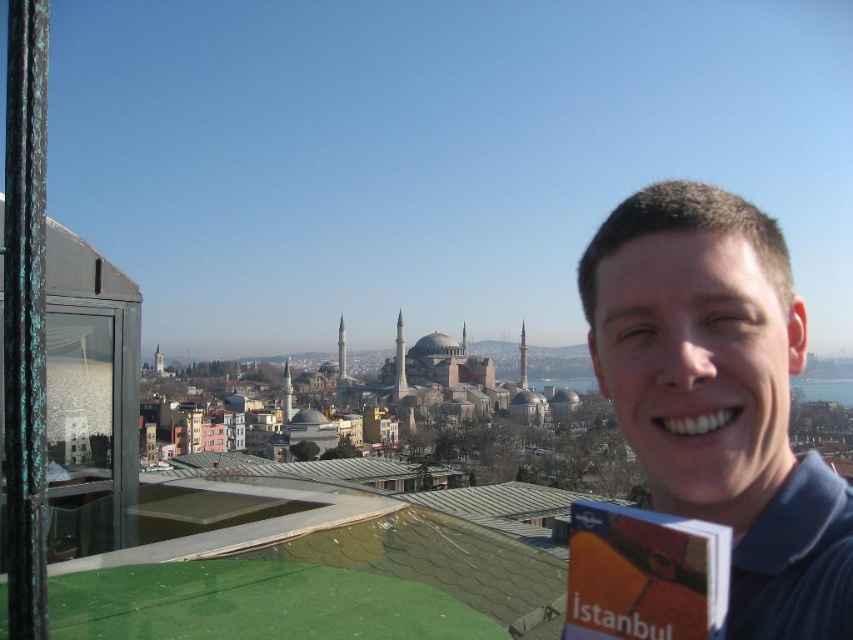
How distant is blue shirt at right from orange paper book at right?

blue shirt at right and orange paper book at right are 17.20 meters apart from each other.

Is point (727, 221) positioned in front of point (643, 513)?

No.

Does point (750, 376) come behind point (567, 593)?

No.

The width and height of the screenshot is (853, 640). Find the location of `blue shirt at right`. blue shirt at right is located at coordinates (720, 396).